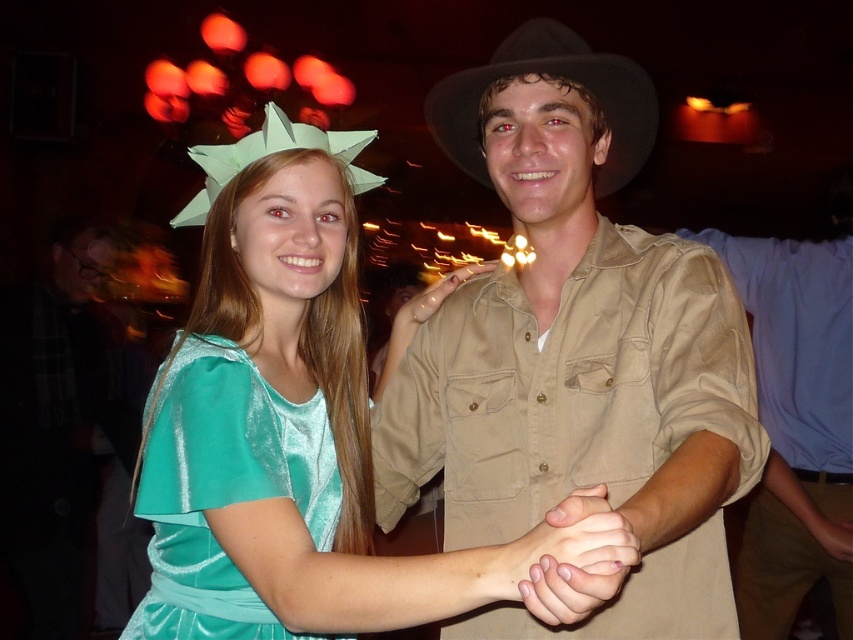
Is point (695, 435) in front of point (461, 72)?

Yes.

Between satin tan shirt at center and black felt fedora at center, which one has less height?

Standing shorter between the two is black felt fedora at center.

This screenshot has height=640, width=853. I want to click on satin tan shirt at center, so click(576, 358).

This screenshot has width=853, height=640. What do you see at coordinates (289, 429) in the screenshot?
I see `velvet green dress at center` at bounding box center [289, 429].

Between point (305, 241) and point (532, 595), which one is positioned behind?

Positioned behind is point (305, 241).

Is point (225, 556) behind point (548, 605)?

Yes, point (225, 556) is behind point (548, 605).

Identify the location of velvet green dress at center. The width and height of the screenshot is (853, 640). (289, 429).

Which is in front, point (186, 433) or point (537, 52)?

Point (186, 433) is more forward.

Who is more distant from viewer, (155, 429) or (590, 88)?

Positioned behind is point (590, 88).

Where is `shiny teal dress at center`? shiny teal dress at center is located at coordinates (223, 486).